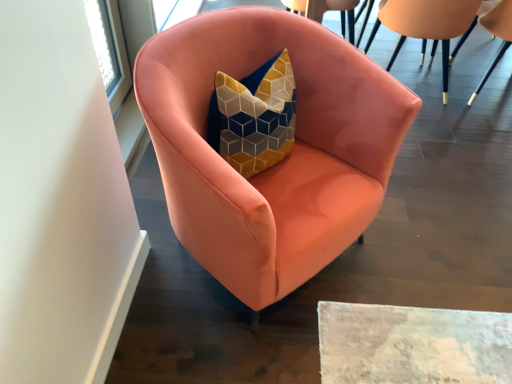
Question: Is matte pink armchair at upper right, which ranks as the 3th chair in left-to-right order, positioned beyond the bounds of matte pink armchair at center, which is the 1th chair from left to right?

Choices:
 (A) yes
 (B) no

Answer: (A)

Question: Are matte pink armchair at upper right, which ranks as the 3th chair in left-to-right order, and matte pink armchair at center, the 3th chair when ordered from right to left, making contact?

Choices:
 (A) no
 (B) yes

Answer: (A)

Question: Can you confirm if matte pink armchair at upper right, which ranks as the 3th chair in left-to-right order, is wider than matte pink armchair at center, the 3th chair when ordered from right to left?

Choices:
 (A) yes
 (B) no

Answer: (B)

Question: From the image's perspective, is matte pink armchair at upper right, which ranks as the 3th chair in left-to-right order, on top of matte pink armchair at center, the 3th chair when ordered from right to left?

Choices:
 (A) no
 (B) yes

Answer: (B)

Question: Is matte pink armchair at upper right, which ranks as the 3th chair in left-to-right order, further to the viewer compared to matte pink armchair at center, the 3th chair when ordered from right to left?

Choices:
 (A) yes
 (B) no

Answer: (A)

Question: From the image's perspective, is matte pink armchair at upper right, marked as the 1th chair in a right-to-left arrangement, beneath matte pink armchair at center, which is the 1th chair from left to right?

Choices:
 (A) yes
 (B) no

Answer: (B)

Question: Is matte pink armchair at center, the 3th chair when ordered from right to left, in front of matte pink armchair at upper right, the second chair from the right?

Choices:
 (A) yes
 (B) no

Answer: (A)

Question: Can you confirm if matte pink armchair at center, the 3th chair when ordered from right to left, is positioned to the right of matte pink armchair at upper right, the second chair from the right?

Choices:
 (A) yes
 (B) no

Answer: (B)

Question: Is matte pink armchair at center, which is the 1th chair from left to right, smaller than matte pink armchair at upper right, the second chair from the right?

Choices:
 (A) yes
 (B) no

Answer: (B)

Question: Is matte pink armchair at upper right, the 2th chair in the left-to-right sequence, located within matte pink armchair at center, which is the 1th chair from left to right?

Choices:
 (A) no
 (B) yes

Answer: (A)

Question: From a real-world perspective, is matte pink armchair at center, which is the 1th chair from left to right, under matte pink armchair at upper right, the 2th chair in the left-to-right sequence?

Choices:
 (A) no
 (B) yes

Answer: (A)

Question: From a real-world perspective, does matte pink armchair at center, the 3th chair when ordered from right to left, stand above matte pink armchair at upper right, the 2th chair in the left-to-right sequence?

Choices:
 (A) no
 (B) yes

Answer: (B)

Question: From the image's perspective, is matte pink armchair at upper right, marked as the 1th chair in a right-to-left arrangement, below matte pink armchair at upper right, the 2th chair in the left-to-right sequence?

Choices:
 (A) yes
 (B) no

Answer: (A)